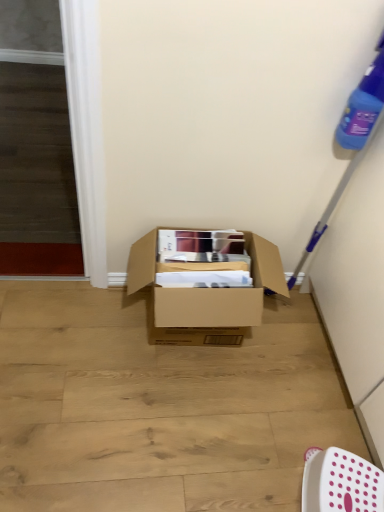
Where is `vacant space in front of brown cardboard box at center`? This screenshot has width=384, height=512. vacant space in front of brown cardboard box at center is located at coordinates (188, 428).